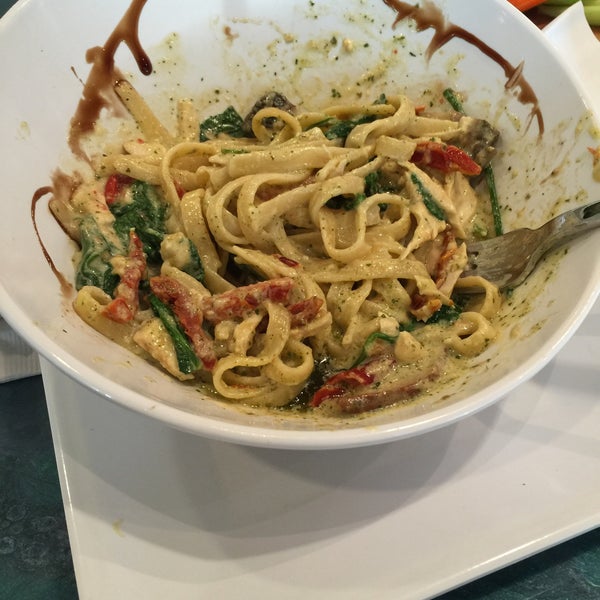
Where is `bowl`? bowl is located at coordinates (280, 427).